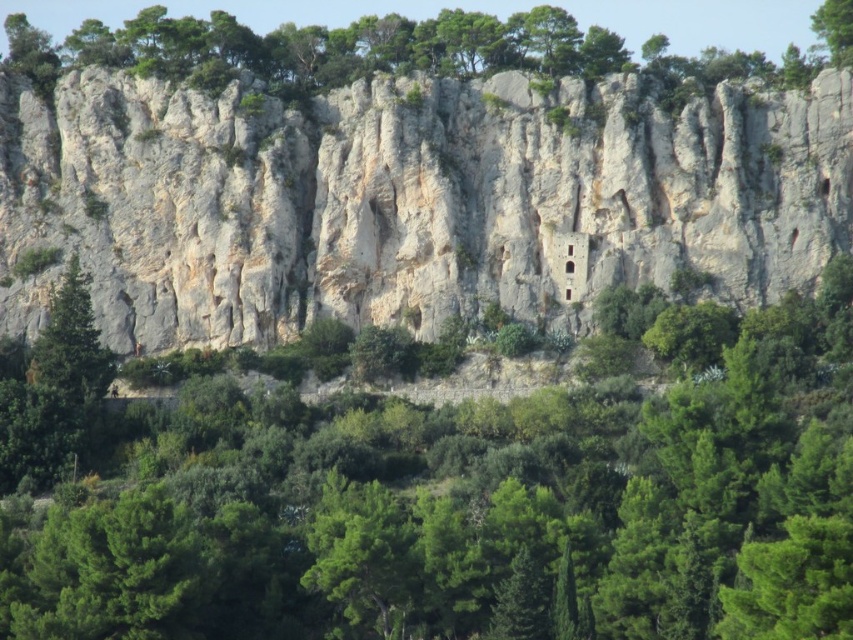
Question: Which of these objects is positioned farthest from the green leafy tree at upper right?

Choices:
 (A) white rock cliff at center
 (B) green leafy tree at center

Answer: (B)

Question: Based on their relative distances, which object is nearer to the green leafy tree at upper right?

Choices:
 (A) green leafy tree at upper center
 (B) white rock cliff at center
 (C) green leafy tree at center

Answer: (A)

Question: Where is green leafy tree at center located in relation to green leafy tree at upper center in the image?

Choices:
 (A) below
 (B) above

Answer: (A)

Question: Is green leafy tree at center to the right of green leafy tree at upper center from the viewer's perspective?

Choices:
 (A) yes
 (B) no

Answer: (B)

Question: Is green leafy tree at center bigger than green leafy tree at upper center?

Choices:
 (A) yes
 (B) no

Answer: (A)

Question: Among these objects, which one is nearest to the camera?

Choices:
 (A) green leafy tree at upper center
 (B) green leafy tree at upper right
 (C) white rock cliff at center
 (D) green leafy tree at center

Answer: (D)